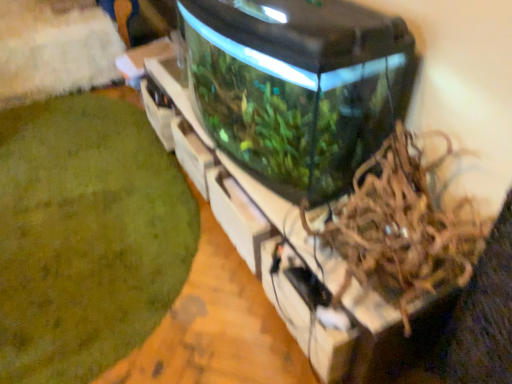
Question: Does transparent glass water tank at center have a larger size compared to brown shredded paper at center-right?

Choices:
 (A) no
 (B) yes

Answer: (B)

Question: Considering the relative sizes of transparent glass water tank at center and brown shredded paper at center-right in the image provided, is transparent glass water tank at center taller than brown shredded paper at center-right?

Choices:
 (A) no
 (B) yes

Answer: (B)

Question: Could you tell me if transparent glass water tank at center is facing brown shredded paper at center-right?

Choices:
 (A) yes
 (B) no

Answer: (B)

Question: Is transparent glass water tank at center turned away from brown shredded paper at center-right?

Choices:
 (A) no
 (B) yes

Answer: (A)

Question: Is transparent glass water tank at center positioned behind brown shredded paper at center-right?

Choices:
 (A) yes
 (B) no

Answer: (A)

Question: From a real-world perspective, relative to green moss at lower left, is brown shredded paper at center-right vertically above or below?

Choices:
 (A) above
 (B) below

Answer: (A)

Question: Considering the positions of brown shredded paper at center-right and green moss at lower left in the image, is brown shredded paper at center-right wider or thinner than green moss at lower left?

Choices:
 (A) thin
 (B) wide

Answer: (A)

Question: Is brown shredded paper at center-right bigger or smaller than green moss at lower left?

Choices:
 (A) big
 (B) small

Answer: (B)

Question: From the image's perspective, is brown shredded paper at center-right located above or below green moss at lower left?

Choices:
 (A) below
 (B) above

Answer: (A)

Question: Is point (421, 175) positioned closer to the camera than point (311, 109)?

Choices:
 (A) farther
 (B) closer

Answer: (A)

Question: Would you say brown shredded paper at center-right is inside or outside transparent glass water tank at center?

Choices:
 (A) outside
 (B) inside

Answer: (A)

Question: Considering the positions of brown shredded paper at center-right and transparent glass water tank at center in the image, is brown shredded paper at center-right wider or thinner than transparent glass water tank at center?

Choices:
 (A) thin
 (B) wide

Answer: (B)

Question: Relative to transparent glass water tank at center, is brown shredded paper at center-right in front or behind?

Choices:
 (A) front
 (B) behind

Answer: (A)

Question: In terms of height, does transparent glass water tank at center look taller or shorter compared to green moss at lower left?

Choices:
 (A) short
 (B) tall

Answer: (B)

Question: Based on their sizes in the image, would you say transparent glass water tank at center is bigger or smaller than green moss at lower left?

Choices:
 (A) small
 (B) big

Answer: (B)